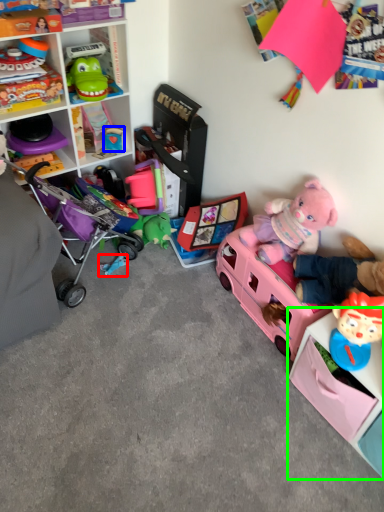
Question: Which object is positioned closest to toy (highlighted by a red box)? Select from toy (highlighted by a blue box) and shelf (highlighted by a green box).

Choices:
 (A) toy
 (B) shelf

Answer: (A)